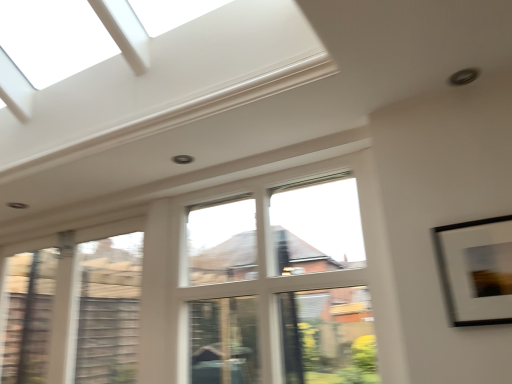
Describe the element at coordinates (476, 270) in the screenshot. The height and width of the screenshot is (384, 512). I see `white matte picture frame at upper right` at that location.

The image size is (512, 384). What do you see at coordinates (109, 310) in the screenshot? I see `clear glass window at left, placed as the second window when sorted from right to left` at bounding box center [109, 310].

Where is `clear glass window at center, acting as the 1th window starting from the right`? The image size is (512, 384). clear glass window at center, acting as the 1th window starting from the right is located at coordinates (217, 285).

Find the location of `white matte picture frame at upper right`. white matte picture frame at upper right is located at coordinates (476, 270).

Looking at this image, considering the sizes of objects clear glass window at left, placed as the second window when sorted from right to left, and white matte picture frame at upper right in the image provided, who is taller, clear glass window at left, placed as the second window when sorted from right to left, or white matte picture frame at upper right?

Standing taller between the two is clear glass window at left, placed as the second window when sorted from right to left.

Is point (119, 277) closer or farther from the camera than point (499, 273)?

Clearly, point (119, 277) is more distant from the camera than point (499, 273).

The height and width of the screenshot is (384, 512). In order to click on the 2nd window behind when counting from the white matte picture frame at upper right in this screenshot , I will do `click(109, 310)`.

Is clear glass window at left, positioned as the 1th window in left-to-right order, looking in the opposite direction of white matte picture frame at upper right?

No, clear glass window at left, positioned as the 1th window in left-to-right order,'s orientation is not away from white matte picture frame at upper right.

Would you say white matte picture frame at upper right is inside or outside clear glass window at center, acting as the 1th window starting from the right?

white matte picture frame at upper right is spatially situated outside clear glass window at center, acting as the 1th window starting from the right.

Considering the positions of objects white matte picture frame at upper right and clear glass window at center, the second window positioned from the left, in the image provided, who is more to the right, white matte picture frame at upper right or clear glass window at center, the second window positioned from the left,?

From the viewer's perspective, white matte picture frame at upper right appears more on the right side.

Is white matte picture frame at upper right not near clear glass window at center, acting as the 1th window starting from the right?

No, there isn't a large distance between white matte picture frame at upper right and clear glass window at center, acting as the 1th window starting from the right.

Does white matte picture frame at upper right have a lesser width compared to clear glass window at center, the second window positioned from the left?

Indeed, white matte picture frame at upper right has a lesser width compared to clear glass window at center, the second window positioned from the left.

From the image's perspective, is clear glass window at center, acting as the 1th window starting from the right, positioned above or below clear glass window at left, positioned as the 1th window in left-to-right order?

Clearly, from the image's perspective, clear glass window at center, acting as the 1th window starting from the right, is above clear glass window at left, positioned as the 1th window in left-to-right order.

Which object is more forward, clear glass window at center, the second window positioned from the left, or clear glass window at left, placed as the second window when sorted from right to left?

Positioned in front is clear glass window at center, the second window positioned from the left.

I want to click on window on the left side of clear glass window at center, the second window positioned from the left, so click(109, 310).

Is white matte picture frame at upper right wider or thinner than clear glass window at left, placed as the second window when sorted from right to left?

In the image, white matte picture frame at upper right appears to be more narrow than clear glass window at left, placed as the second window when sorted from right to left.

Who is shorter, white matte picture frame at upper right or clear glass window at left, positioned as the 1th window in left-to-right order?

white matte picture frame at upper right is shorter.

In the scene shown: From the image's perspective, is clear glass window at center, the second window positioned from the left, located above white matte picture frame at upper right?

No.

Is clear glass window at center, acting as the 1th window starting from the right, to the left or to the right of white matte picture frame at upper right in the image?

clear glass window at center, acting as the 1th window starting from the right, is to the left of white matte picture frame at upper right.

Is clear glass window at center, acting as the 1th window starting from the right, positioned with its back to white matte picture frame at upper right?

That's not correct — clear glass window at center, acting as the 1th window starting from the right, is not looking away from white matte picture frame at upper right.

Locate an element on the screen. window located on the right of clear glass window at left, positioned as the 1th window in left-to-right order is located at coordinates (217, 285).

Between clear glass window at left, positioned as the 1th window in left-to-right order, and clear glass window at center, the second window positioned from the left, which one has more height?

Standing taller between the two is clear glass window at center, the second window positioned from the left.

Which is behind, point (101, 346) or point (67, 332)?

The point (67, 332) is farther from the camera.

You are a GUI agent. You are given a task and a screenshot of the screen. Output one action in this format:
    pyautogui.click(x=<x>, y=<y>)
    Task: Click on the 2nd window counting from the left of the white matte picture frame at upper right
    
    Given the screenshot: What is the action you would take?
    pyautogui.click(x=109, y=310)

Image resolution: width=512 pixels, height=384 pixels. What are the coordinates of `picture frame on the right of the clear glass window at center, the second window positioned from the left` in the screenshot? It's located at (476, 270).

Based on their spatial positions, is white matte picture frame at upper right or clear glass window at center, the second window positioned from the left, closer to clear glass window at left, positioned as the 1th window in left-to-right order?

clear glass window at center, the second window positioned from the left.

From the picture: Which object lies further to the anchor point clear glass window at center, the second window positioned from the left, white matte picture frame at upper right or clear glass window at left, positioned as the 1th window in left-to-right order?

white matte picture frame at upper right lies further to clear glass window at center, the second window positioned from the left, than the other object.

Looking at the image, which one is located further to clear glass window at left, positioned as the 1th window in left-to-right order, clear glass window at center, the second window positioned from the left, or white matte picture frame at upper right?

The object further to clear glass window at left, positioned as the 1th window in left-to-right order, is white matte picture frame at upper right.

Looking at the image, which one is located further to white matte picture frame at upper right, clear glass window at left, positioned as the 1th window in left-to-right order, or clear glass window at center, acting as the 1th window starting from the right?

clear glass window at left, positioned as the 1th window in left-to-right order, lies further to white matte picture frame at upper right than the other object.

Based on their spatial positions, is clear glass window at center, acting as the 1th window starting from the right, or clear glass window at left, positioned as the 1th window in left-to-right order, further from white matte picture frame at upper right?

clear glass window at left, positioned as the 1th window in left-to-right order, is positioned further to the anchor white matte picture frame at upper right.

Considering their positions, is clear glass window at left, placed as the second window when sorted from right to left, positioned further to clear glass window at center, acting as the 1th window starting from the right, than white matte picture frame at upper right?

The object further to clear glass window at center, acting as the 1th window starting from the right, is white matte picture frame at upper right.

This screenshot has width=512, height=384. Identify the location of window between clear glass window at left, positioned as the 1th window in left-to-right order, and white matte picture frame at upper right. (217, 285).